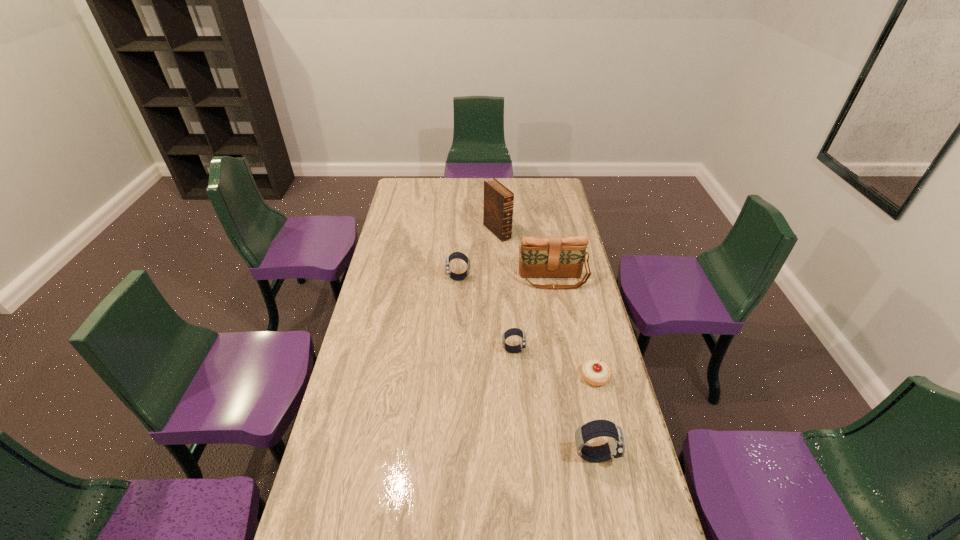
Where is `empty space between the second tallest object and the tallest watch`? empty space between the second tallest object and the tallest watch is located at coordinates (573, 367).

This screenshot has height=540, width=960. What are the coordinates of `free space between the nearest watch and the fifth shortest object` in the screenshot? It's located at (573, 367).

At what (x,y) coordinates should I click in order to perform the action: click on free space between the shortest object and the shoulder bag. Please return your answer as a coordinate pair (x, y). Looking at the image, I should click on [x=574, y=328].

In order to click on vacant space in between the shoulder bag and the nearest watch in this screenshot , I will do `click(573, 367)`.

Where is `free spot between the shoulder bag and the shortest watch`? This screenshot has width=960, height=540. free spot between the shoulder bag and the shortest watch is located at coordinates (533, 315).

The width and height of the screenshot is (960, 540). Identify the location of vacant region between the third shortest object and the shoulder bag. (505, 279).

Find the location of a particular element. free space between the second shortest object and the shoulder bag is located at coordinates (533, 315).

This screenshot has width=960, height=540. I want to click on object that ranks as the closest to the leftmost object, so click(540, 257).

Identify which object is the closest to the shoulder bag. Please provide its 2D coordinates. Your answer should be formatted as a tuple, i.e. [(x, y)], where the tuple contains the x and y coordinates of a point satisfying the conditions above.

[(456, 255)]

In order to click on watch that stands as the closest to the fifth shortest object in this screenshot , I will do `click(456, 255)`.